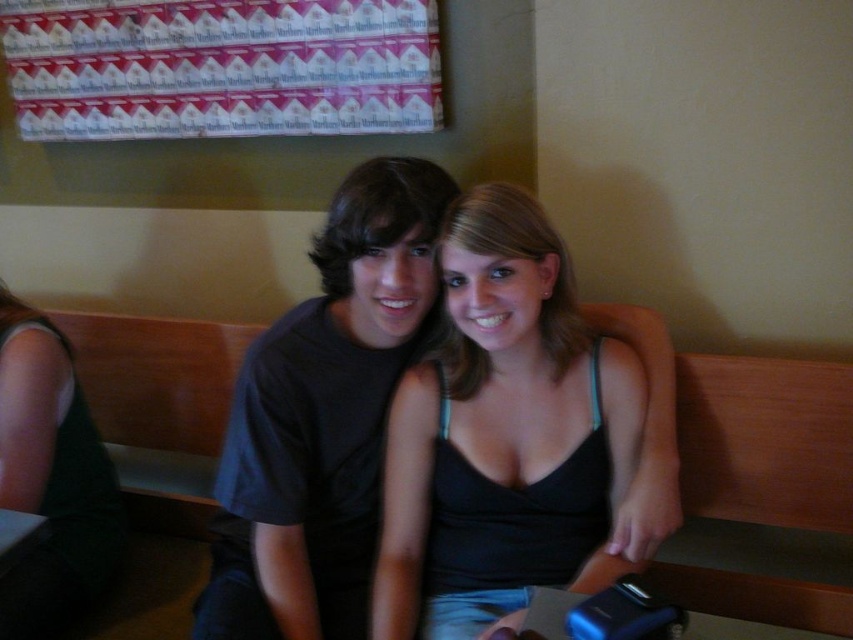
You are standing in the dining area and want to place a small plant between the two points, point (503, 552) and point (260, 621). Based on their positions, which point should the plant be closer to in order to be centered between them?

The plant should be closer to point (260, 621) because point (503, 552) is behind it, so the midpoint between them would be nearer to the front point.